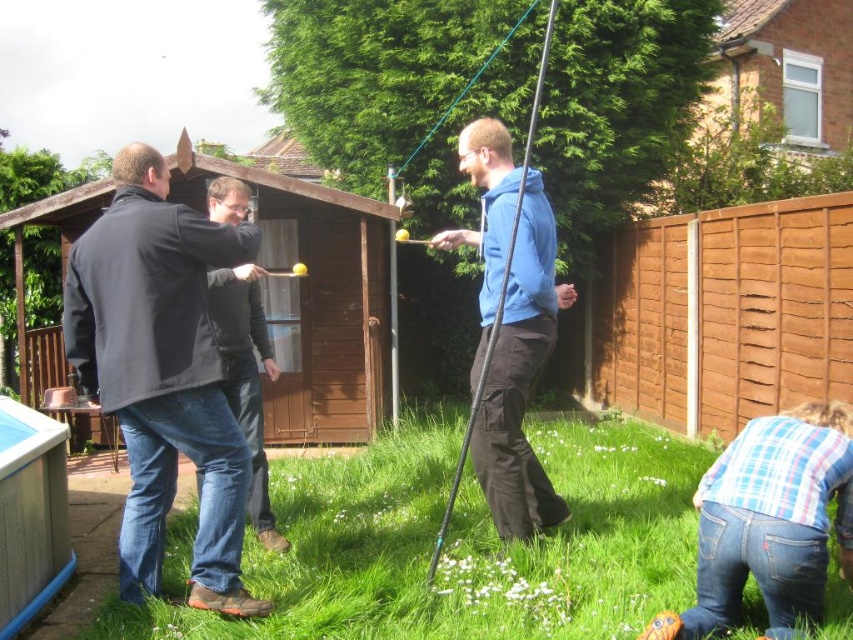
In the scene shown: You are standing in the backyard scene and want to place a small garden gnome exactly where the green grass at lower center is located. According to the coordinates provided, where should you place the gnome?

The green grass at lower center is located at coordinates point (456,547), so you should place the garden gnome there.

You are trying to find the green grass at lower center in the backyard scene. Where would you look relative to the dark blue jacket at left?

The green grass at lower center is in front of the dark blue jacket at left, so you should look towards the area closer to the front of the dark blue jacket at left to find it.

You are standing in the backyard and want to reach the point marked as point (103, 352). If you take a step forward of 1 meter, will you be closer to the point?

The distance between you and point (103, 352) is 3.26 meters. After taking a step forward of 1 meter, you will be 2.26 meters away from the point, so yes, you will be closer to the point.